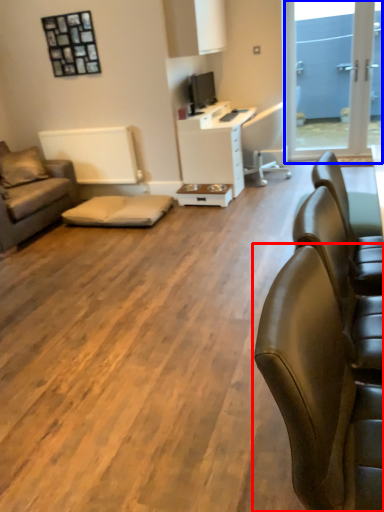
Question: Among these objects, which one is farthest to the camera, chair (highlighted by a red box) or window screen (highlighted by a blue box)?

Choices:
 (A) chair
 (B) window screen

Answer: (B)